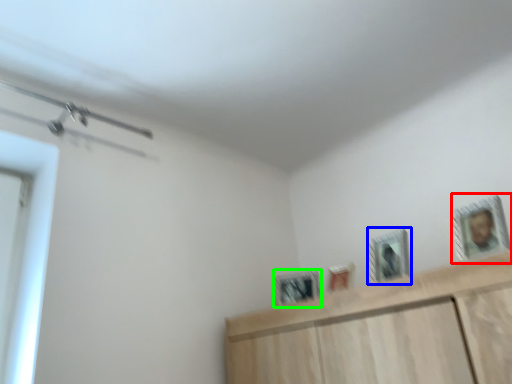
Question: Considering the real-world distances, which object is closest to picture frame (highlighted by a red box)? picture frame (highlighted by a blue box) or picture frame (highlighted by a green box).

Choices:
 (A) picture frame
 (B) picture frame

Answer: (A)